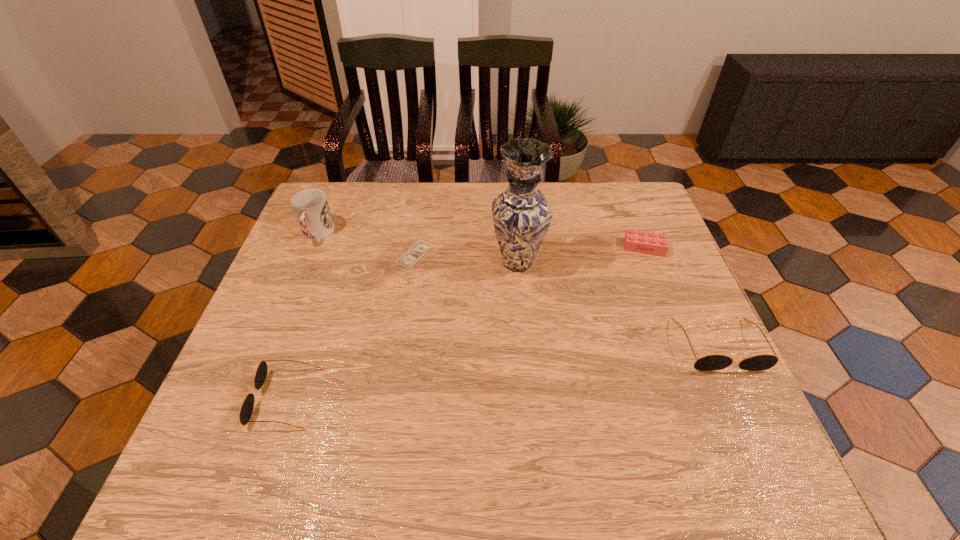
At what (x,y) coordinates should I click in order to perform the action: click on the shorter sunglasses. Please return your answer as a coordinate pair (x, y). Looking at the image, I should click on (246, 410).

The width and height of the screenshot is (960, 540). What are the coordinates of `the third shortest object` in the screenshot? It's located at (246, 410).

Image resolution: width=960 pixels, height=540 pixels. In order to click on the right sunglasses in this screenshot , I will do `click(713, 362)`.

Locate an element on the screen. The height and width of the screenshot is (540, 960). the taller sunglasses is located at coordinates (713, 362).

Identify the location of the shortest object. The height and width of the screenshot is (540, 960). (420, 248).

Locate an element on the screen. the fourth object from right to left is located at coordinates (420, 248).

Locate an element on the screen. The height and width of the screenshot is (540, 960). the second shortest object is located at coordinates (653, 243).

Locate an element on the screen. Image resolution: width=960 pixels, height=540 pixels. the second tallest object is located at coordinates (311, 209).

Identify the location of the fourth object from left to right. (521, 214).

This screenshot has width=960, height=540. Find the location of `the tallest object`. the tallest object is located at coordinates (521, 214).